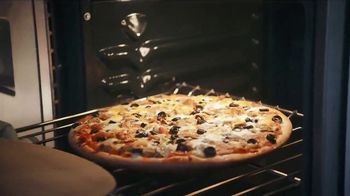
What are the coordinates of `left side wall of oven` in the screenshot? It's located at (182, 15).